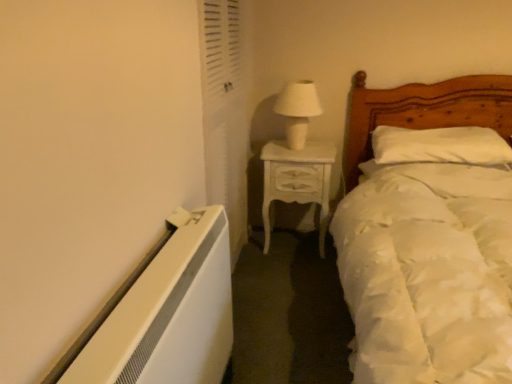
Question: Can you confirm if white ceramic table lamp at upper center is thinner than white satin bed at right?

Choices:
 (A) no
 (B) yes

Answer: (B)

Question: Is white ceramic table lamp at upper center located outside white satin bed at right?

Choices:
 (A) no
 (B) yes

Answer: (B)

Question: Would you say white ceramic table lamp at upper center contains white satin bed at right?

Choices:
 (A) no
 (B) yes

Answer: (A)

Question: From a real-world perspective, is white ceramic table lamp at upper center located higher than white satin bed at right?

Choices:
 (A) yes
 (B) no

Answer: (A)

Question: Is white ceramic table lamp at upper center facing towards white satin bed at right?

Choices:
 (A) no
 (B) yes

Answer: (B)

Question: Would you say white soft pillow at center is to the left or to the right of white ceramic table lamp at upper center in the picture?

Choices:
 (A) right
 (B) left

Answer: (A)

Question: Which is correct: white soft pillow at center is inside white ceramic table lamp at upper center, or outside of it?

Choices:
 (A) outside
 (B) inside

Answer: (A)

Question: Is point (425, 147) closer or farther from the camera than point (288, 115)?

Choices:
 (A) closer
 (B) farther

Answer: (A)

Question: From a real-world perspective, relative to white ceramic table lamp at upper center, is white soft pillow at center vertically above or below?

Choices:
 (A) above
 (B) below

Answer: (B)

Question: Is white satin bed at right bigger or smaller than white soft pillow at center?

Choices:
 (A) small
 (B) big

Answer: (B)

Question: Considering their positions, is white satin bed at right located in front of or behind white soft pillow at center?

Choices:
 (A) behind
 (B) front

Answer: (B)

Question: From the image's perspective, is white satin bed at right above or below white soft pillow at center?

Choices:
 (A) above
 (B) below

Answer: (B)

Question: From a real-world perspective, relative to white soft pillow at center, is white satin bed at right vertically above or below?

Choices:
 (A) above
 (B) below

Answer: (B)

Question: Does point (409, 135) appear closer or farther from the camera than point (297, 188)?

Choices:
 (A) closer
 (B) farther

Answer: (A)

Question: Considering the positions of white soft pillow at center and white glossy nightstand at center in the image, is white soft pillow at center taller or shorter than white glossy nightstand at center?

Choices:
 (A) short
 (B) tall

Answer: (A)